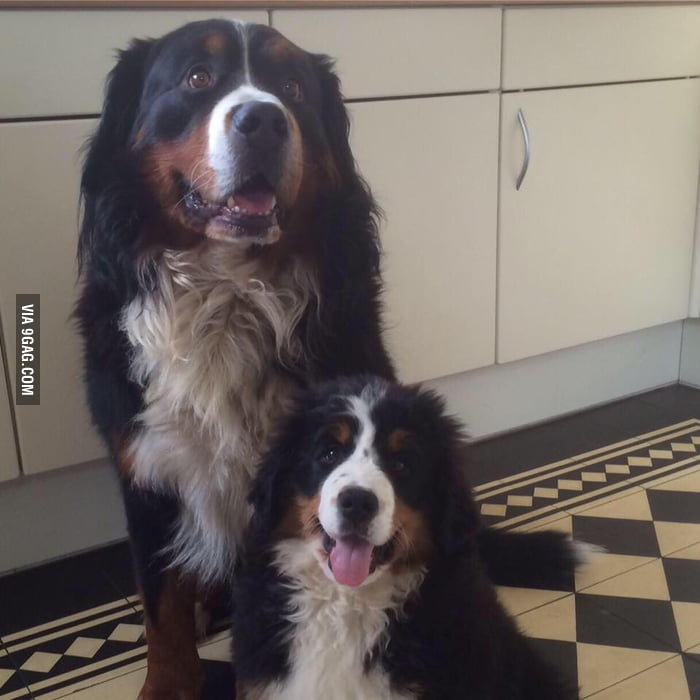
Identify the location of tiled floor. tap(612, 517).